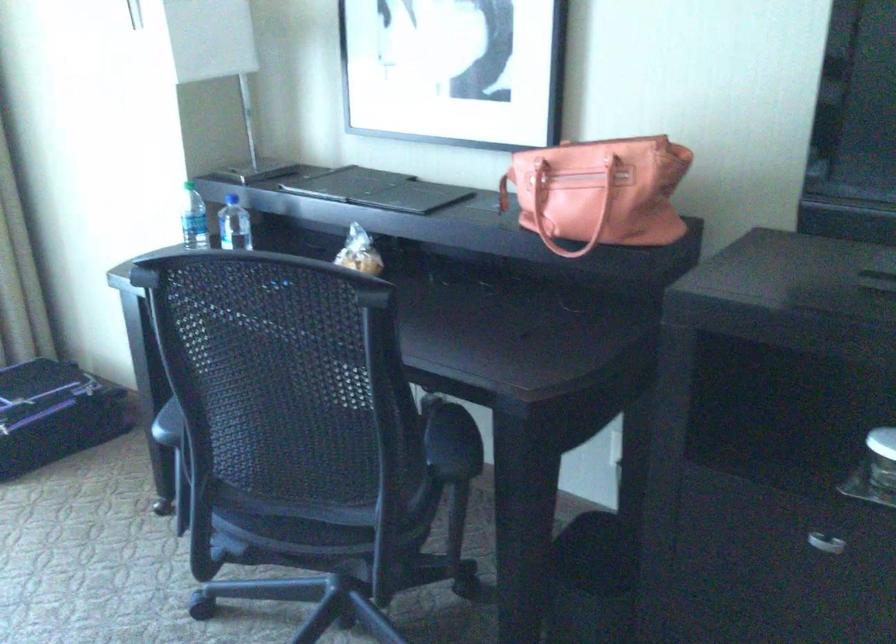
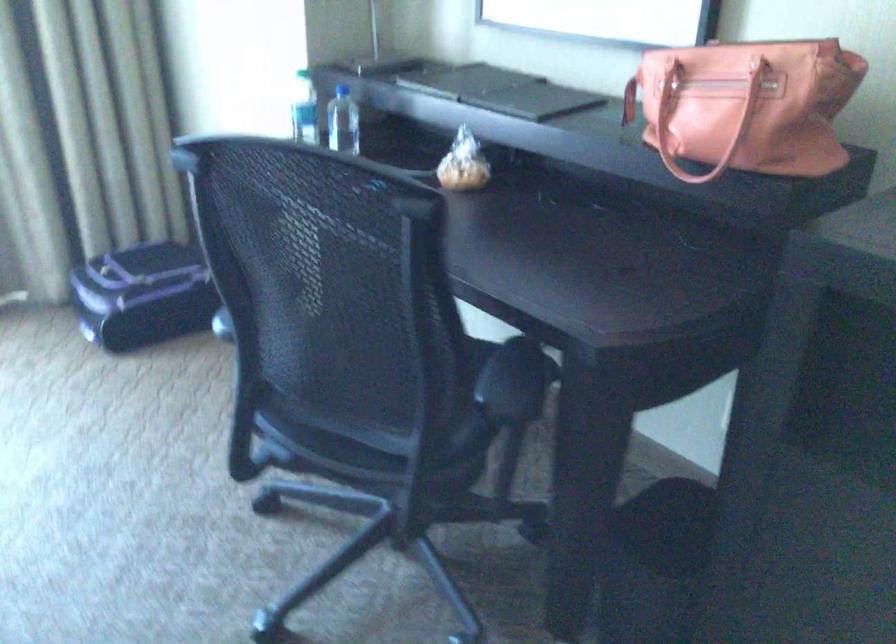
In the second image, find the point that corresponds to [573,205] in the first image.

(704, 122)